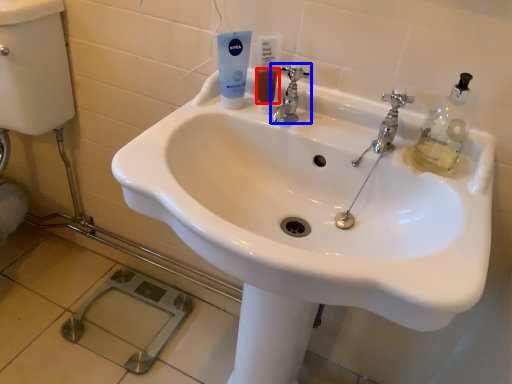
Question: Which point is further to the camera, liquid (highlighted by a red box) or tap (highlighted by a blue box)?

Choices:
 (A) liquid
 (B) tap

Answer: (A)